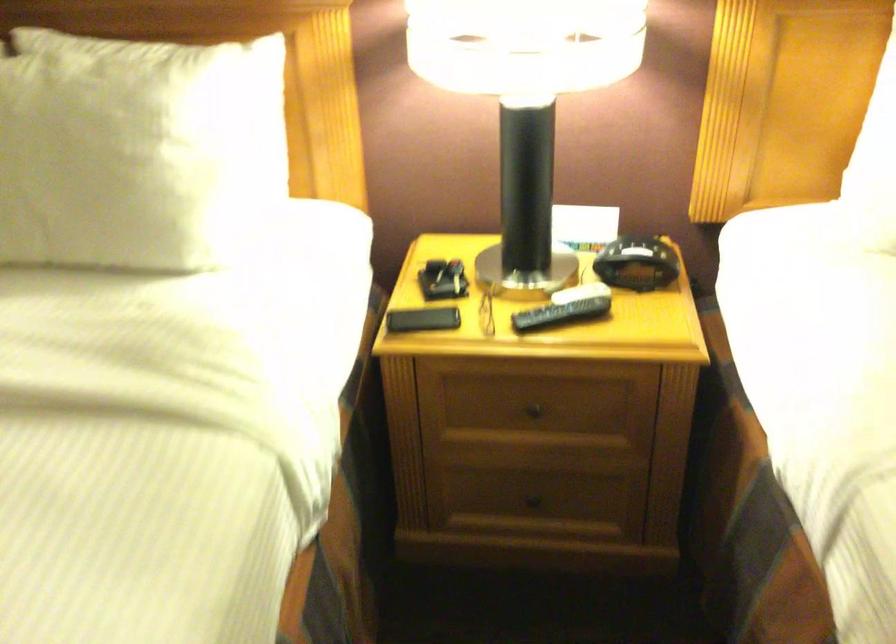
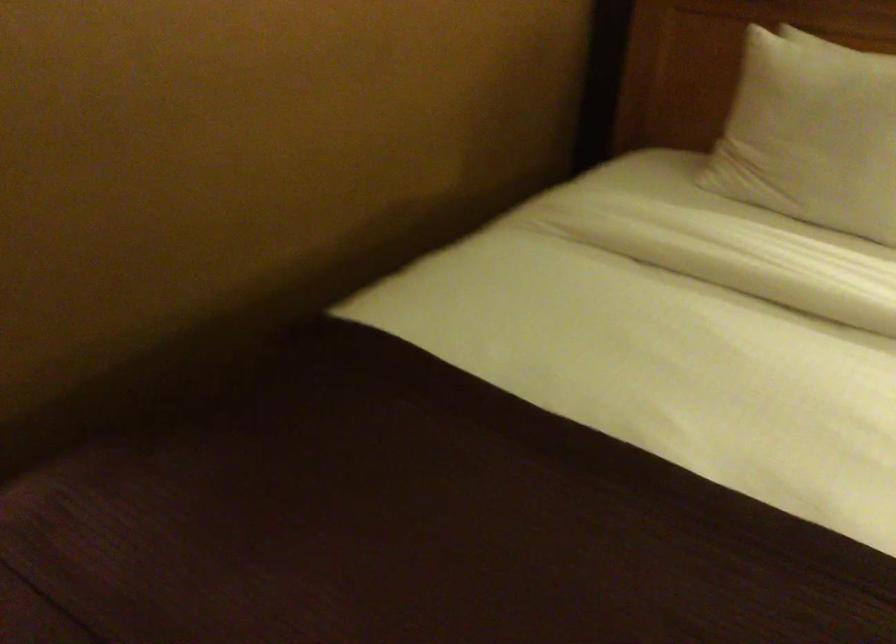
Question: How did the camera likely rotate?

Choices:
 (A) Left
 (B) Right
 (C) Up
 (D) Down

Answer: (A)